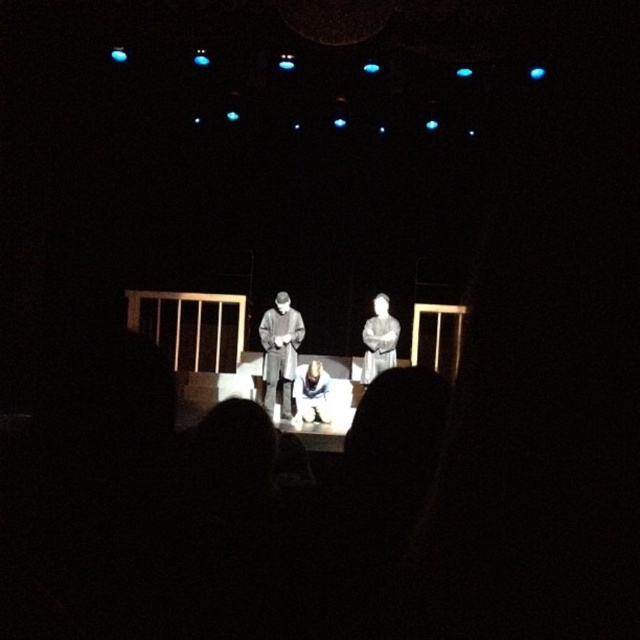
Is smooth gray robe at center shorter than white fabric at center?

No, smooth gray robe at center is not shorter than white fabric at center.

Is point (385, 323) behind point (320, 412)?

Yes, it is behind point (320, 412).

Find the location of a particular element. Image resolution: width=640 pixels, height=640 pixels. smooth gray robe at center is located at coordinates (378, 339).

Find the location of a particular element. smooth gray robe at center is located at coordinates click(378, 339).

Looking at this image, does gray fabric coat at center appear under white fabric at center?

Actually, gray fabric coat at center is above white fabric at center.

Is gray fabric coat at center smaller than white fabric at center?

No, gray fabric coat at center is not smaller than white fabric at center.

Between point (273, 310) and point (305, 410), which one is positioned behind?

Positioned behind is point (273, 310).

Find the location of a particular element. gray fabric coat at center is located at coordinates (280, 352).

Based on the photo, is gray fabric coat at center positioned before smooth gray robe at center?

Yes.

Locate an element on the screen. The width and height of the screenshot is (640, 640). gray fabric coat at center is located at coordinates (280, 352).

This screenshot has height=640, width=640. I want to click on gray fabric coat at center, so click(x=280, y=352).